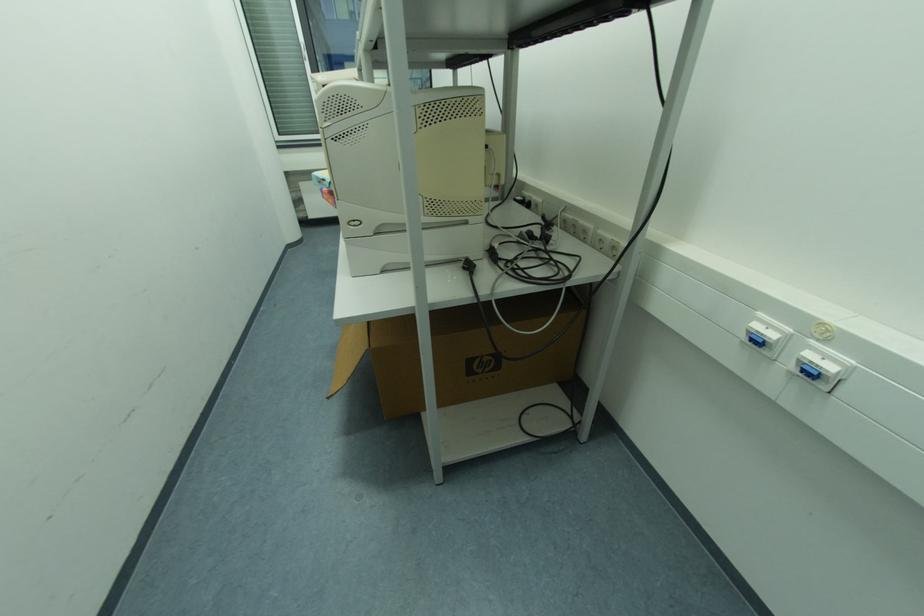
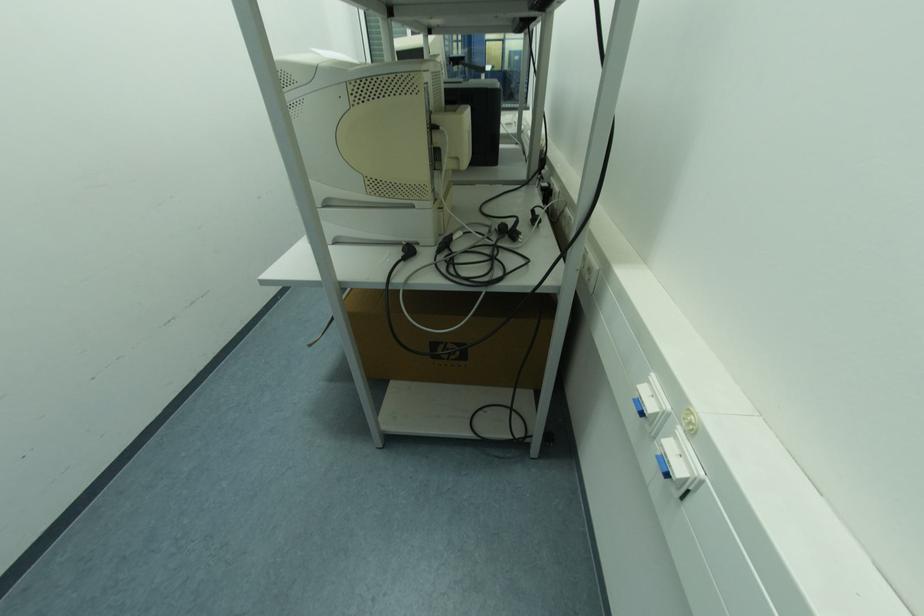
Question: Which direction would the cameraman need to move to produce the second image? Reply with the corresponding letter.

Choices:
 (A) Left
 (B) Right
 (C) Forward
 (D) Backward

Answer: (B)